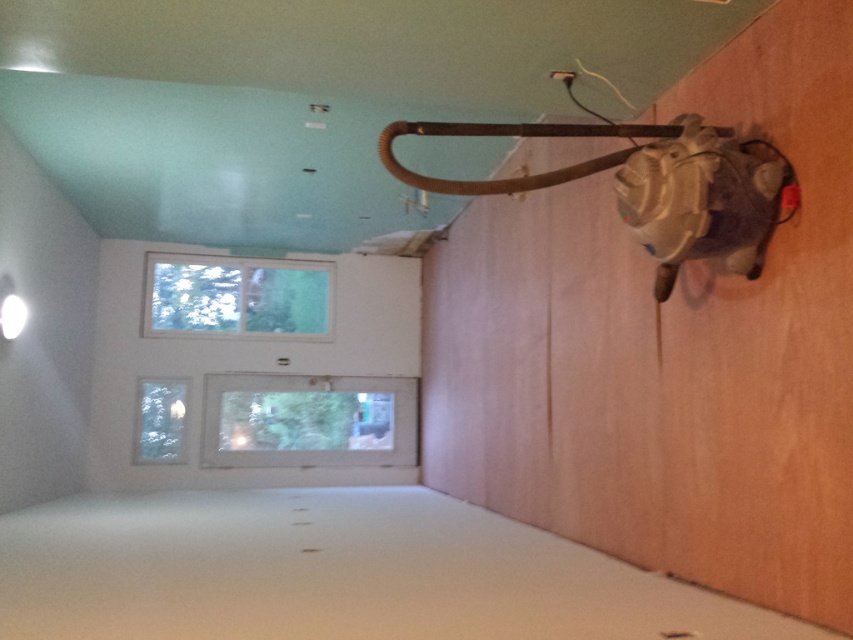
Question: Which object is positioned farthest from the clear glass window at upper center?

Choices:
 (A) clear glass window at lower left
 (B) clear glass window at center

Answer: (A)

Question: Can you confirm if clear glass window at upper center is thinner than clear glass window at lower left?

Choices:
 (A) no
 (B) yes

Answer: (A)

Question: Does clear glass window at center have a larger size compared to clear glass window at upper center?

Choices:
 (A) yes
 (B) no

Answer: (A)

Question: Which point is farther to the camera?

Choices:
 (A) clear glass window at center
 (B) clear glass window at upper center
 (C) clear glass window at lower left

Answer: (B)

Question: Observing the image, what is the correct spatial positioning of clear glass window at upper center in reference to clear glass window at lower left?

Choices:
 (A) above
 (B) below

Answer: (A)

Question: Estimate the real-world distances between objects in this image. Which object is farther from the clear glass window at lower left?

Choices:
 (A) clear glass window at upper center
 (B) clear glass window at center

Answer: (A)